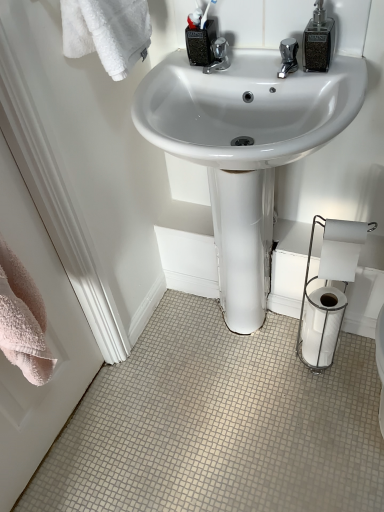
Image resolution: width=384 pixels, height=512 pixels. Find the location of `matte black soap dispenser at upper right`. matte black soap dispenser at upper right is located at coordinates (318, 41).

Locate an element on the screen. The width and height of the screenshot is (384, 512). white matte toilet paper at lower right, which is the 3th toilet paper from bottom to top is located at coordinates (341, 249).

Identify the location of matte black soap dispenser at upper right. (318, 41).

Are white matte toilet paper at lower right, the first toilet paper from the top, and white paper at lower right, arranged as the 2th toilet paper when ordered from the bottom, located far from each other?

No, white matte toilet paper at lower right, the first toilet paper from the top, is not far away from white paper at lower right, arranged as the 2th toilet paper when ordered from the bottom.

Between point (325, 247) and point (301, 357), which one is positioned behind?

The point (301, 357) is farther.

From a real-world perspective, is white matte toilet paper at lower right, which is the 3th toilet paper from bottom to top, below white paper at lower right, arranged as the 2th toilet paper when ordered from the bottom?

No, from a real-world perspective, white matte toilet paper at lower right, which is the 3th toilet paper from bottom to top, is not beneath white paper at lower right, arranged as the 2th toilet paper when ordered from the bottom.

Which of these two, white matte toilet paper at lower right, the first toilet paper from the top, or white paper at lower right, arranged as the 2th toilet paper when ordered from the bottom, stands taller?

white paper at lower right, arranged as the 2th toilet paper when ordered from the bottom, is taller.

Could white glossy toilet paper at lower right, which is the 1th toilet paper in bottom-to-top order, be considered to be inside pink towel at left?

No, white glossy toilet paper at lower right, which is the 1th toilet paper in bottom-to-top order, is located outside of pink towel at left.

In the scene shown: From the image's perspective, is pink towel at left above or below white glossy toilet paper at lower right, which is counted as the 3th toilet paper, starting from the top?

Based on their image positions, pink towel at left is located above white glossy toilet paper at lower right, which is counted as the 3th toilet paper, starting from the top.

Can you tell me how much pink towel at left and white glossy toilet paper at lower right, which is the 1th toilet paper in bottom-to-top order, differ in facing direction?

There is a 90-degree angle between the facing directions of pink towel at left and white glossy toilet paper at lower right, which is the 1th toilet paper in bottom-to-top order.

The image size is (384, 512). I want to click on the 3rd toilet paper counting from the right side of the pink towel at left, so (x=322, y=325).

Is white glossy sink at center inside or outside of white matte toilet paper at lower right, which is the 3th toilet paper from bottom to top?

white glossy sink at center cannot be found inside white matte toilet paper at lower right, which is the 3th toilet paper from bottom to top.

From a real-world perspective, relative to white matte toilet paper at lower right, which is the 3th toilet paper from bottom to top, is white glossy sink at center vertically above or below?

white glossy sink at center is below white matte toilet paper at lower right, which is the 3th toilet paper from bottom to top.

Would you say white glossy sink at center is a long distance from white matte toilet paper at lower right, which is the 3th toilet paper from bottom to top?

They are positioned close to each other.

The height and width of the screenshot is (512, 384). Identify the location of sink in front of the white matte toilet paper at lower right, which is the 3th toilet paper from bottom to top. (246, 109).

From the picture: Does white paper at lower right, arranged as the 2th toilet paper when ordered from the bottom, come in front of white matte toilet paper at lower right, which is the 3th toilet paper from bottom to top?

That is True.

Image resolution: width=384 pixels, height=512 pixels. In order to click on toilet paper in front of the white matte toilet paper at lower right, the first toilet paper from the top in this screenshot , I will do `click(329, 290)`.

From the image's perspective, is white paper at lower right, arranged as the 2th toilet paper when ordered from the bottom, located beneath white matte toilet paper at lower right, which is the 3th toilet paper from bottom to top?

Yes, from the image's perspective, white paper at lower right, arranged as the 2th toilet paper when ordered from the bottom, is below white matte toilet paper at lower right, which is the 3th toilet paper from bottom to top.

Is white paper at lower right, arranged as the 2th toilet paper when ordered from the bottom, surrounding white matte toilet paper at lower right, the first toilet paper from the top?

Yes, white matte toilet paper at lower right, the first toilet paper from the top, is a part of white paper at lower right, arranged as the 2th toilet paper when ordered from the bottom.

Considering the relative positions of matte black soap dispenser at upper right and white matte toilet paper at lower right, the first toilet paper from the top, in the image provided, is matte black soap dispenser at upper right behind white matte toilet paper at lower right, the first toilet paper from the top,?

No.

Can you confirm if matte black soap dispenser at upper right is taller than white matte toilet paper at lower right, which is the 3th toilet paper from bottom to top?

In fact, matte black soap dispenser at upper right may be shorter than white matte toilet paper at lower right, which is the 3th toilet paper from bottom to top.

Considering the sizes of objects matte black soap dispenser at upper right and white matte toilet paper at lower right, which is the 3th toilet paper from bottom to top, in the image provided, who is thinner, matte black soap dispenser at upper right or white matte toilet paper at lower right, which is the 3th toilet paper from bottom to top,?

white matte toilet paper at lower right, which is the 3th toilet paper from bottom to top.

From a real-world perspective, does matte black soap dispenser at upper right sit lower than white matte toilet paper at lower right, the first toilet paper from the top?

No, from a real-world perspective, matte black soap dispenser at upper right is not under white matte toilet paper at lower right, the first toilet paper from the top.

In the scene shown: Does pink towel at left contain white paper at lower right, arranged as the 2th toilet paper when ordered from the bottom?

Definitely not — white paper at lower right, arranged as the 2th toilet paper when ordered from the bottom, is not inside pink towel at left.

Considering the positions of objects pink towel at left and white paper at lower right, arranged as the 2th toilet paper when ordered from the bottom, in the image provided, who is more to the left, pink towel at left or white paper at lower right, arranged as the 2th toilet paper when ordered from the bottom,?

Positioned to the left is pink towel at left.

Is pink towel at left placed right next to white paper at lower right, the second toilet paper in the top-to-bottom sequence?

pink towel at left and white paper at lower right, the second toilet paper in the top-to-bottom sequence, are not in contact.

Between white glossy toilet paper at lower right, which is counted as the 3th toilet paper, starting from the top, and white paper at lower right, arranged as the 2th toilet paper when ordered from the bottom, which one has smaller size?

With smaller size is white glossy toilet paper at lower right, which is counted as the 3th toilet paper, starting from the top.

Considering their positions, is white glossy toilet paper at lower right, which is counted as the 3th toilet paper, starting from the top, located in front of or behind white paper at lower right, arranged as the 2th toilet paper when ordered from the bottom?

white glossy toilet paper at lower right, which is counted as the 3th toilet paper, starting from the top, is positioned farther from the viewer than white paper at lower right, arranged as the 2th toilet paper when ordered from the bottom.

Based on the photo, which object is thinner, white glossy toilet paper at lower right, which is counted as the 3th toilet paper, starting from the top, or white paper at lower right, arranged as the 2th toilet paper when ordered from the bottom?

Thinner between the two is white paper at lower right, arranged as the 2th toilet paper when ordered from the bottom.

Locate an element on the screen. The height and width of the screenshot is (512, 384). toilet paper that appears above the white paper at lower right, arranged as the 2th toilet paper when ordered from the bottom (from the image's perspective) is located at coordinates (341, 249).

This screenshot has width=384, height=512. What are the coordinates of `screen door on the left of white glossy toilet paper at lower right, which is counted as the 3th toilet paper, starting from the top` in the screenshot? It's located at [47, 341].

When comparing their distances from white matte toilet paper at lower right, the first toilet paper from the top, does white glossy sink at center or white paper at lower right, the second toilet paper in the top-to-bottom sequence, seem further?

white glossy sink at center.

Based on their spatial positions, is white matte toilet paper at lower right, the first toilet paper from the top, or white glossy toilet paper at lower right, which is counted as the 3th toilet paper, starting from the top, further from white glossy sink at center?

white glossy toilet paper at lower right, which is counted as the 3th toilet paper, starting from the top.

Based on their spatial positions, is matte black soap dispenser at upper right or white glossy toilet paper at lower right, which is counted as the 3th toilet paper, starting from the top, closer to matte black container at upper center?

Among the two, matte black soap dispenser at upper right is located nearer to matte black container at upper center.

From the image, which object appears to be nearer to pink towel at left, white glossy sink at center or matte black container at upper center?

white glossy sink at center is closer to pink towel at left.

When comparing their distances from matte black soap dispenser at upper right, does matte black container at upper center or white paper at lower right, the second toilet paper in the top-to-bottom sequence, seem closer?

Among the two, matte black container at upper center is located nearer to matte black soap dispenser at upper right.

Looking at the image, which one is located closer to matte black container at upper center, white glossy toilet paper at lower right, which is the 1th toilet paper in bottom-to-top order, or white glossy sink at center?

Based on the image, white glossy sink at center appears to be nearer to matte black container at upper center.

Looking at the image, which one is located further to white glossy sink at center, white matte toilet paper at lower right, the first toilet paper from the top, or matte black soap dispenser at upper right?

white matte toilet paper at lower right, the first toilet paper from the top, is positioned further to the anchor white glossy sink at center.

Considering their positions, is white glossy sink at center positioned further to white paper at lower right, the second toilet paper in the top-to-bottom sequence, than matte black container at upper center?

matte black container at upper center.

Locate an element on the screen. The height and width of the screenshot is (512, 384). sink between matte black container at upper center and white glossy toilet paper at lower right, which is counted as the 3th toilet paper, starting from the top, in the up-down direction is located at coordinates (246, 109).

The image size is (384, 512). Identify the location of soap dispenser situated between pink towel at left and white paper at lower right, the second toilet paper in the top-to-bottom sequence, from left to right. (318, 41).

Locate an element on the screen. toilet paper situated between pink towel at left and white matte toilet paper at lower right, the first toilet paper from the top, from left to right is located at coordinates (329, 290).

At what (x,y) coordinates should I click in order to perform the action: click on sink between matte black soap dispenser at upper right and white glossy toilet paper at lower right, which is the 1th toilet paper in bottom-to-top order, from top to bottom. Please return your answer as a coordinate pair (x, y). Looking at the image, I should click on click(246, 109).